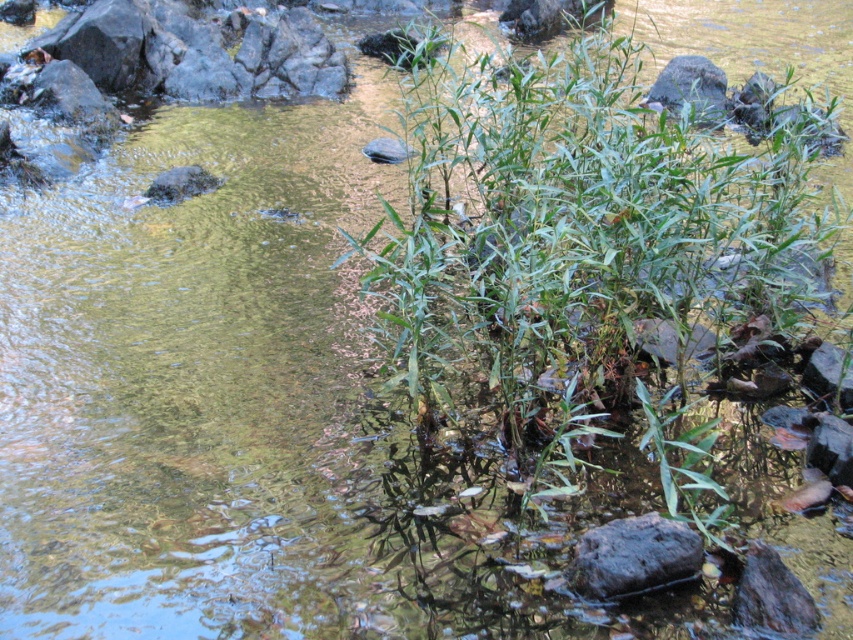
You are a botanist studying aquatic plants. You observe the green leafy plant at center and the dark gray rock at center in the image. Which object is located above the other?

The green leafy plant at center is positioned over the dark gray rock at center.

You are a gardener who needs to place a 4.5 feet long wooden board between the green leafy plant at center and the dark gray rock at center. Can you fit the board between them without bending it?

The distance between the green leafy plant at center and the dark gray rock at center is 3.91 feet. Since the board is 4.5 feet long, it is longer than the available space. Therefore, the board cannot be placed straight between them without bending it.